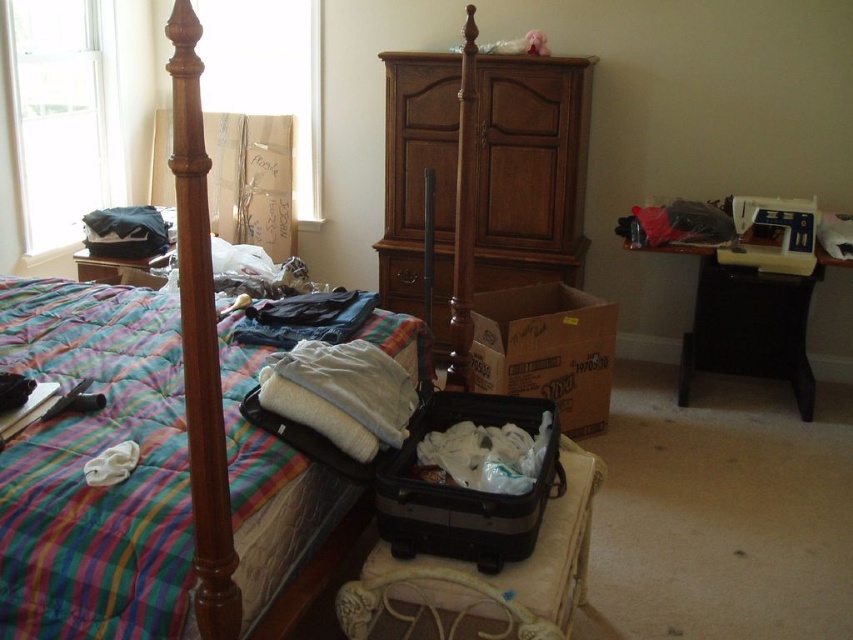
Based on the photo, does wooden cabinet at center have a greater width compared to black hardshell suitcase at center?

Indeed, wooden cabinet at center has a greater width compared to black hardshell suitcase at center.

Between wooden cabinet at center and black hardshell suitcase at center, which one is positioned lower?

black hardshell suitcase at center is lower down.

Locate an element on the screen. wooden cabinet at center is located at coordinates (480, 179).

Between plaid fabric bed at center and cardboard box at center, which one is positioned higher?

Positioned higher is plaid fabric bed at center.

Can you confirm if plaid fabric bed at center is wider than cardboard box at center?

Correct, the width of plaid fabric bed at center exceeds that of cardboard box at center.

Describe the element at coordinates (157, 474) in the screenshot. I see `plaid fabric bed at center` at that location.

The height and width of the screenshot is (640, 853). I want to click on plaid fabric bed at center, so click(x=157, y=474).

Is point (268, 436) farther from viewer compared to point (461, 426)?

No, (268, 436) is closer to viewer.

Can you confirm if plaid fabric bed at center is positioned to the right of white fabric at center?

Incorrect, plaid fabric bed at center is not on the right side of white fabric at center.

What do you see at coordinates (157, 474) in the screenshot? Image resolution: width=853 pixels, height=640 pixels. I see `plaid fabric bed at center` at bounding box center [157, 474].

Identify the location of plaid fabric bed at center. This screenshot has height=640, width=853. (157, 474).